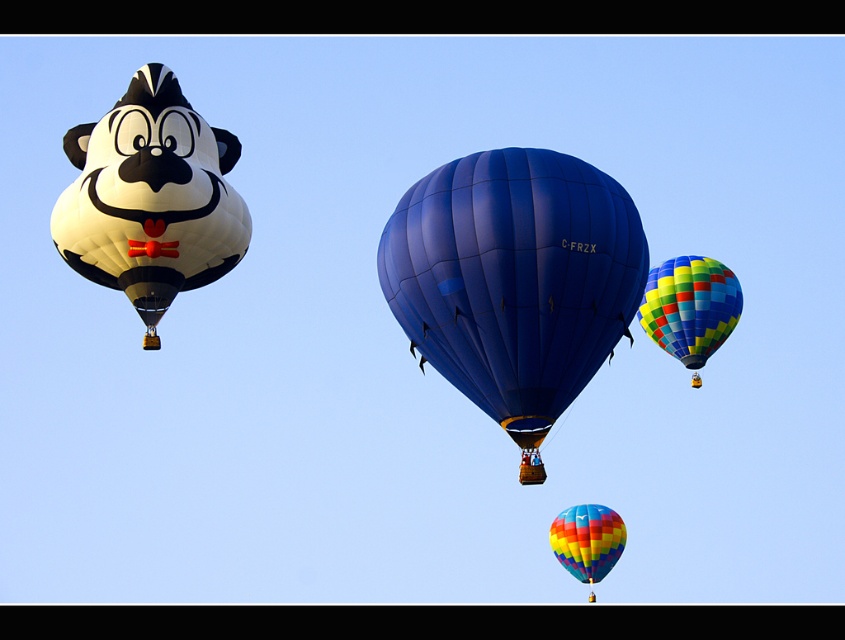
Is blue glossy hot air balloon at center wider than multicolored fabric hot air balloon at upper right?

No, blue glossy hot air balloon at center is not wider than multicolored fabric hot air balloon at upper right.

Is point (525, 182) in front of point (720, 333)?

That is True.

Is point (633, 301) less distant than point (673, 339)?

Yes, point (633, 301) is in front of point (673, 339).

The height and width of the screenshot is (640, 845). I want to click on blue glossy hot air balloon at center, so click(x=514, y=282).

Who is more distant from viewer, (127,180) or (693,324)?

The point (693,324) is more distant.

Does white matte balloon at left come behind multicolored fabric hot air balloon at upper right?

No, it is in front of multicolored fabric hot air balloon at upper right.

Between point (151, 276) and point (662, 273), which one is positioned in front?

Point (151, 276)

Identify the location of white matte balloon at left. (x=151, y=198).

Describe the element at coordinates (514, 282) in the screenshot. The image size is (845, 640). I see `blue glossy hot air balloon at center` at that location.

Does blue glossy hot air balloon at center come behind white matte balloon at left?

No, blue glossy hot air balloon at center is in front of white matte balloon at left.

Is point (448, 173) positioned before point (164, 195)?

Yes.

The height and width of the screenshot is (640, 845). I want to click on blue glossy hot air balloon at center, so click(514, 282).